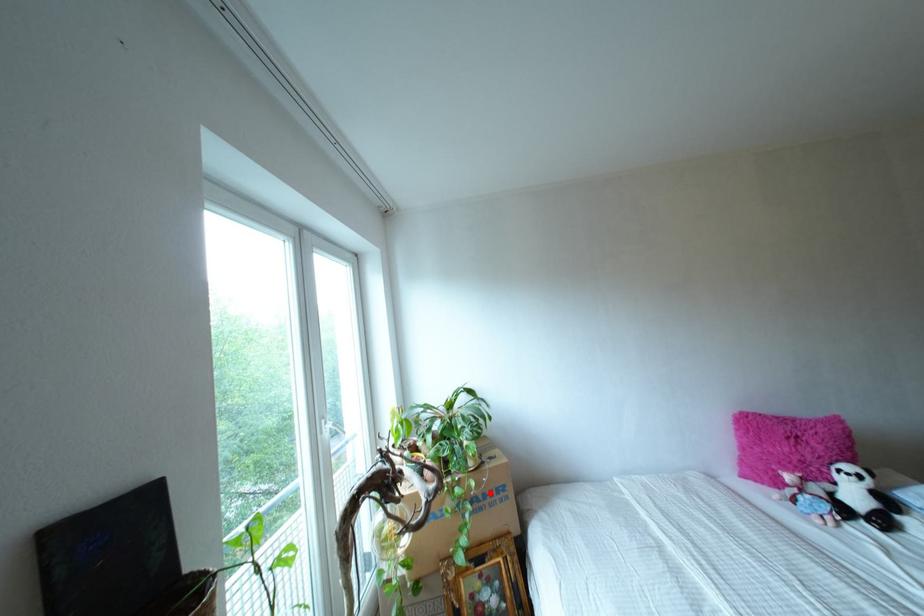
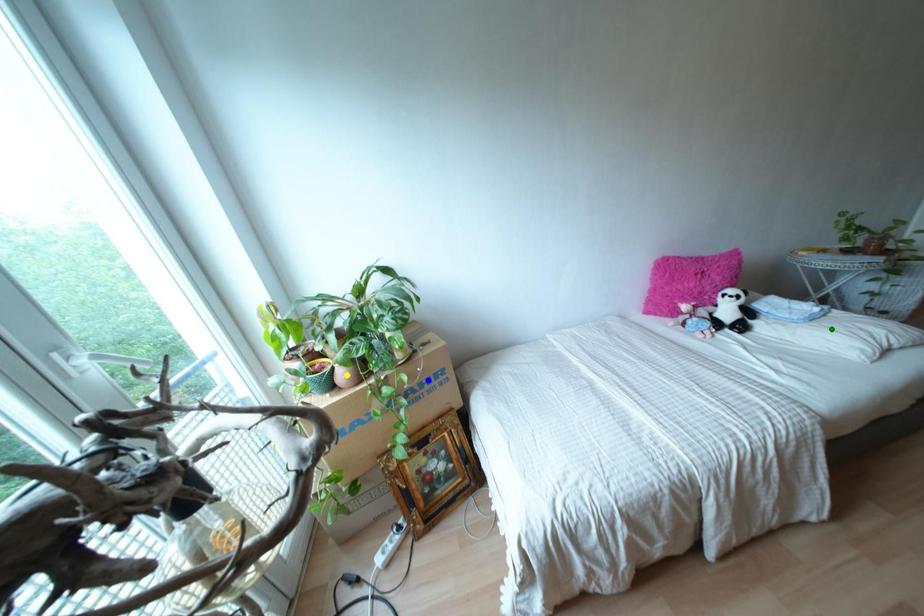
Question: I am providing you with two images of the same scene from different viewpoints. A red point is marked on the first image. You are given multiple points on the second image. In image 2, which mark is for the same physical point as the one in image 1?

Choices:
 (A) green point
 (B) yellow point
 (C) blue point

Answer: (C)